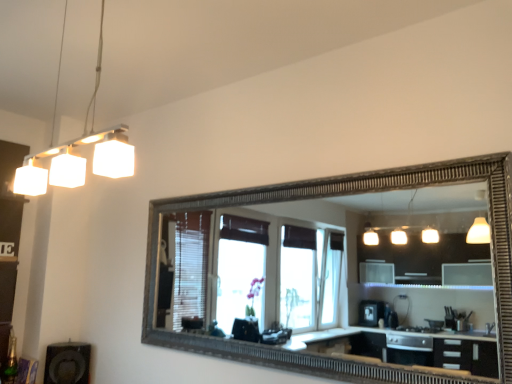
Image resolution: width=512 pixels, height=384 pixels. What are the coordinates of `matte white dresser at left` in the screenshot? It's located at (9, 239).

Identify the location of black matte speaker at lower left. (67, 363).

The image size is (512, 384). Find the location of `white matte light fixture at upper left`. white matte light fixture at upper left is located at coordinates (76, 155).

Consider the image. From a real-world perspective, is black matte speaker at lower left positioned above or below matte white dresser at left?

In terms of real-world spatial position, black matte speaker at lower left is below matte white dresser at left.

The image size is (512, 384). Find the location of `dresser in front of the black matte speaker at lower left`. dresser in front of the black matte speaker at lower left is located at coordinates (9, 239).

Is black matte speaker at lower left turned away from matte white dresser at left?

black matte speaker at lower left does not have its back to matte white dresser at left.

Is black matte speaker at lower left not near matte white dresser at left?

They are positioned close to each other.

Which of these two, white matte light fixture at upper left or matte white dresser at left, is wider?

Wider between the two is matte white dresser at left.

From the image's perspective, is white matte light fixture at upper left below matte white dresser at left?

No, from the image's perspective, white matte light fixture at upper left is not below matte white dresser at left.

In the scene shown: From a real-world perspective, is white matte light fixture at upper left positioned above or below matte white dresser at left?

From a real-world perspective, white matte light fixture at upper left is physically above matte white dresser at left.

Is white matte light fixture at upper left placed right next to matte white dresser at left?

No, white matte light fixture at upper left is not touching matte white dresser at left.

Can you tell me how much white matte light fixture at upper left and black matte speaker at lower left differ in facing direction?

There is a 90-degree angle between the facing directions of white matte light fixture at upper left and black matte speaker at lower left.

Is white matte light fixture at upper left bigger or smaller than black matte speaker at lower left?

In the image, white matte light fixture at upper left appears to be larger than black matte speaker at lower left.

Which object is more forward, white matte light fixture at upper left or black matte speaker at lower left?

white matte light fixture at upper left.

Is white matte light fixture at upper left a part of matte white dresser at left?

No, matte white dresser at left does not contain white matte light fixture at upper left.

From the image's perspective, which one is positioned higher, matte white dresser at left or white matte light fixture at upper left?

white matte light fixture at upper left, from the image's perspective.

Which is in front, point (15, 224) or point (45, 192)?

The point (45, 192) is closer to the camera.

Are matte white dresser at left and black matte speaker at lower left located far from each other?

matte white dresser at left is near black matte speaker at lower left, not far away.

Considering the sizes of objects matte white dresser at left and black matte speaker at lower left in the image provided, who is bigger, matte white dresser at left or black matte speaker at lower left?

matte white dresser at left.

From a real-world perspective, who is located higher, matte white dresser at left or black matte speaker at lower left?

From a 3D spatial view, matte white dresser at left is above.

Is black matte speaker at lower left inside the boundaries of white matte light fixture at upper left, or outside?

The correct answer is: outside.

Is white matte light fixture at upper left at the back of black matte speaker at lower left?

No, black matte speaker at lower left's orientation is not away from white matte light fixture at upper left.

Considering the positions of points (60, 359) and (69, 186), is point (60, 359) closer to camera compared to point (69, 186)?

That is True.

Visually, is black matte speaker at lower left positioned to the left or to the right of white matte light fixture at upper left?

From the image, it's evident that black matte speaker at lower left is to the left of white matte light fixture at upper left.

Image resolution: width=512 pixels, height=384 pixels. In order to click on speaker that appears below the matte white dresser at left (from a real-world perspective) in this screenshot , I will do `click(67, 363)`.

Find the location of `dresser behind the white matte light fixture at upper left`. dresser behind the white matte light fixture at upper left is located at coordinates (9, 239).

When comparing their distances from matte white dresser at left, does black matte speaker at lower left or white matte light fixture at upper left seem closer?

Based on the image, white matte light fixture at upper left appears to be nearer to matte white dresser at left.

When comparing their distances from white matte light fixture at upper left, does matte white dresser at left or black matte speaker at lower left seem closer?

matte white dresser at left.

Estimate the real-world distances between objects in this image. Which object is further from white matte light fixture at upper left, black matte speaker at lower left or matte white dresser at left?

Based on the image, black matte speaker at lower left appears to be further to white matte light fixture at upper left.

Based on their spatial positions, is matte white dresser at left or white matte light fixture at upper left further from black matte speaker at lower left?

Among the two, white matte light fixture at upper left is located further to black matte speaker at lower left.

Estimate the real-world distances between objects in this image. Which object is further from matte white dresser at left, white matte light fixture at upper left or black matte speaker at lower left?

The object further to matte white dresser at left is black matte speaker at lower left.

Considering their positions, is white matte light fixture at upper left positioned closer to black matte speaker at lower left than matte white dresser at left?

Among the two, matte white dresser at left is located nearer to black matte speaker at lower left.

Where is `dresser between white matte light fixture at upper left and black matte speaker at lower left from front to back`? The height and width of the screenshot is (384, 512). dresser between white matte light fixture at upper left and black matte speaker at lower left from front to back is located at coordinates (9, 239).